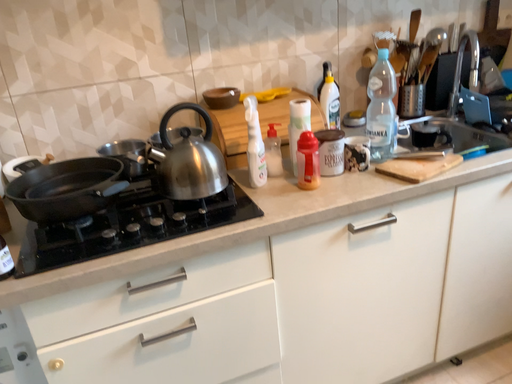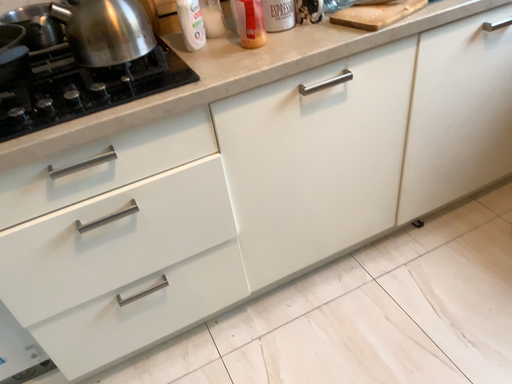
Question: Which way did the camera rotate in the video?

Choices:
 (A) rotated upward
 (B) rotated downward

Answer: (B)